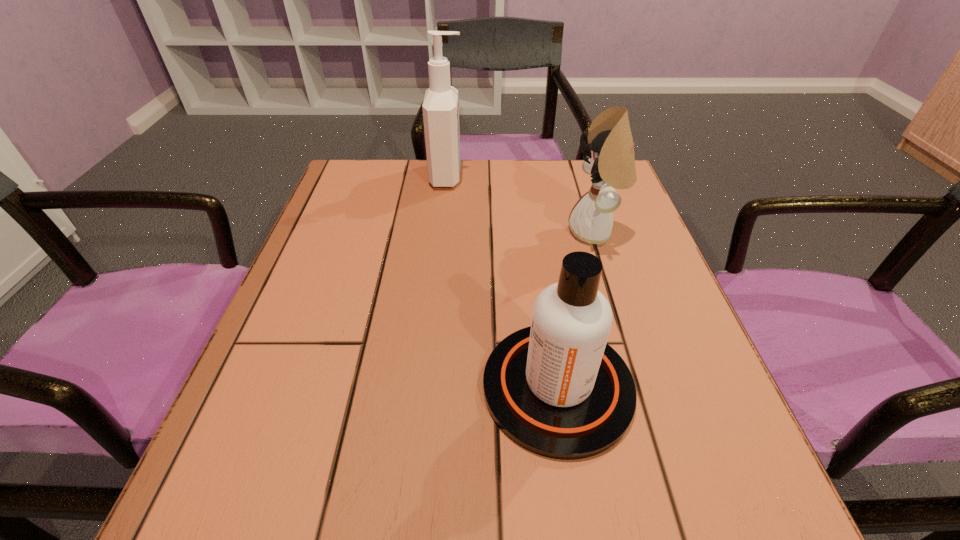
Where is `free point that satisfies the following two spatial constraints: 1. on the front label of the right cleansing agent; 2. on the left side of the tallest object`? This screenshot has width=960, height=540. free point that satisfies the following two spatial constraints: 1. on the front label of the right cleansing agent; 2. on the left side of the tallest object is located at coordinates (425, 387).

Where is `free location that satisfies the following two spatial constraints: 1. on the front label of the taller cleansing agent; 2. on the back side of the nearest object`? The image size is (960, 540). free location that satisfies the following two spatial constraints: 1. on the front label of the taller cleansing agent; 2. on the back side of the nearest object is located at coordinates (425, 387).

At what (x,y) coordinates should I click in order to perform the action: click on vacant space that satisfies the following two spatial constraints: 1. on the front label of the taller cleansing agent; 2. on the left side of the nearest object. Please return your answer as a coordinate pair (x, y). Image resolution: width=960 pixels, height=540 pixels. Looking at the image, I should click on (425, 387).

Locate an element on the screen. vacant area in the image that satisfies the following two spatial constraints: 1. on the back side of the right cleansing agent; 2. on the front label of the farthest object is located at coordinates (526, 176).